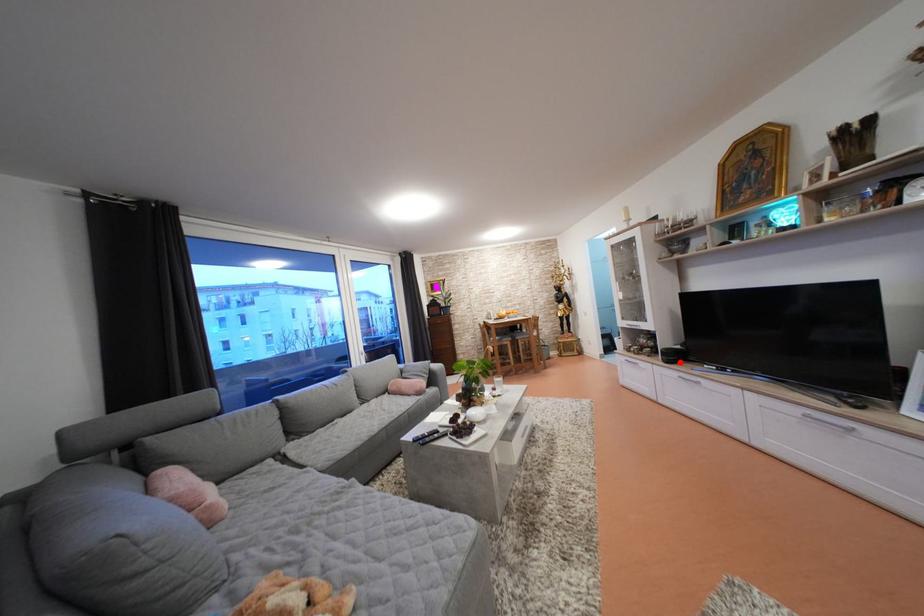
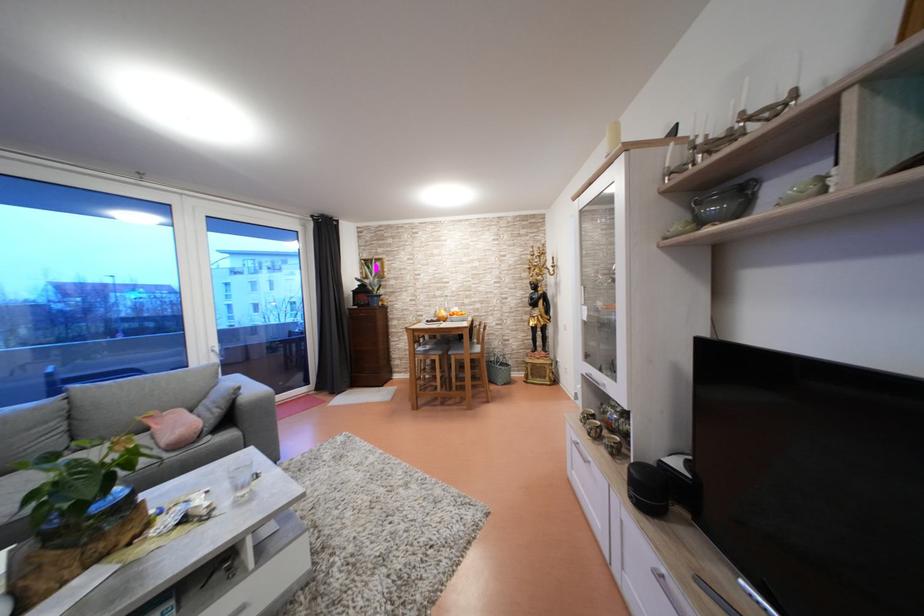
In the second image, find the point that corresponds to the highlighted location in the first image.

(662, 500)